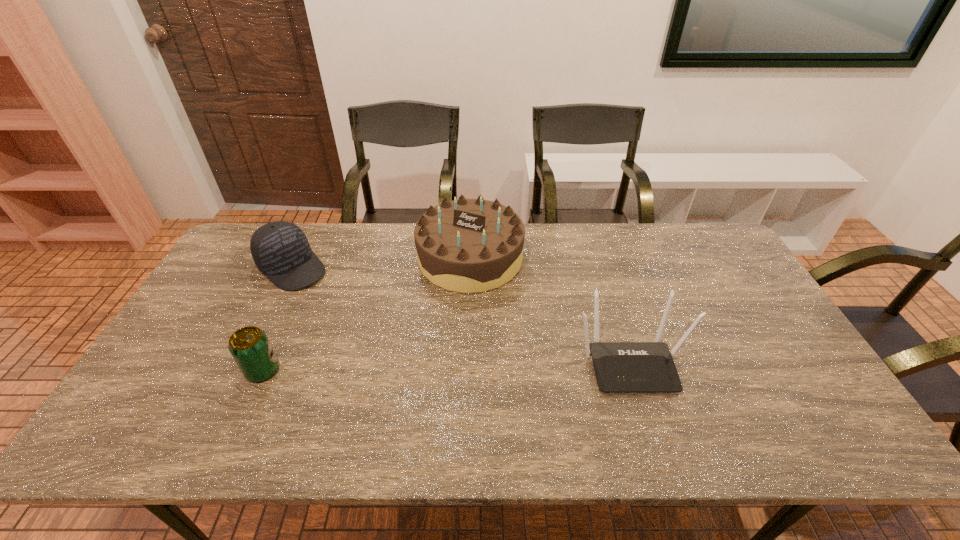
Find the location of a particular element. beer can is located at coordinates (249, 346).

Identify the location of router. (620, 367).

The height and width of the screenshot is (540, 960). Find the location of `baseball cap`. baseball cap is located at coordinates (280, 249).

You are a GUI agent. You are given a task and a screenshot of the screen. Output one action in this format:
    pyautogui.click(x=<x>, y=<y>)
    Task: Click on the second object from right to left
    
    Given the screenshot: What is the action you would take?
    pyautogui.click(x=467, y=245)

I want to click on free space located on the back of the beer can, so click(291, 306).

This screenshot has width=960, height=540. What are the coordinates of `vacant space located 0.280m at the front of the baseball cap where the brim is located` in the screenshot? It's located at (366, 329).

You are a GUI agent. You are given a task and a screenshot of the screen. Output one action in this format:
    pyautogui.click(x=<x>, y=<y>)
    Task: Click on the vacant space situated 0.400m at the front of the baseball cap where the brim is located
    This screenshot has height=540, width=960.
    Given the screenshot: What is the action you would take?
    pyautogui.click(x=393, y=353)

Identify the location of free space located at the front of the baseball cap where the brim is located. The height and width of the screenshot is (540, 960). (349, 315).

The image size is (960, 540). Find the location of `vacant region located on the front-facing side of the third object from left to right`. vacant region located on the front-facing side of the third object from left to right is located at coordinates (448, 390).

Where is `vacant space situated on the front-facing side of the third object from left to right`? The height and width of the screenshot is (540, 960). vacant space situated on the front-facing side of the third object from left to right is located at coordinates pyautogui.click(x=450, y=376).